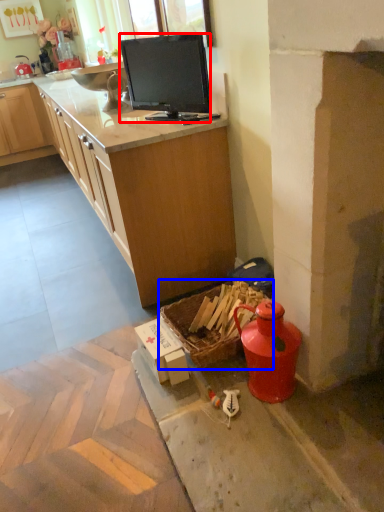
Question: Which object is closer to the camera taking this photo, television (highlighted by a red box) or picnic basket (highlighted by a blue box)?

Choices:
 (A) television
 (B) picnic basket

Answer: (B)